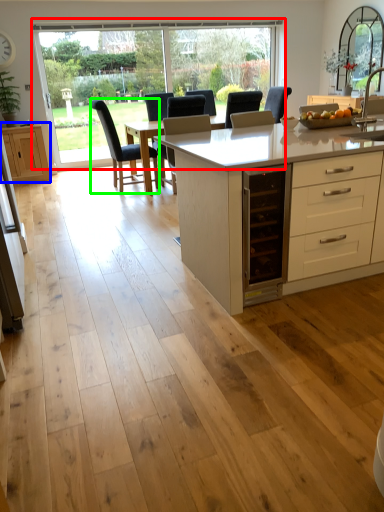
Question: Considering the real-world distances, which object is closest to window (highlighted by a red box)? cabinetry (highlighted by a blue box) or chair (highlighted by a green box).

Choices:
 (A) cabinetry
 (B) chair

Answer: (A)